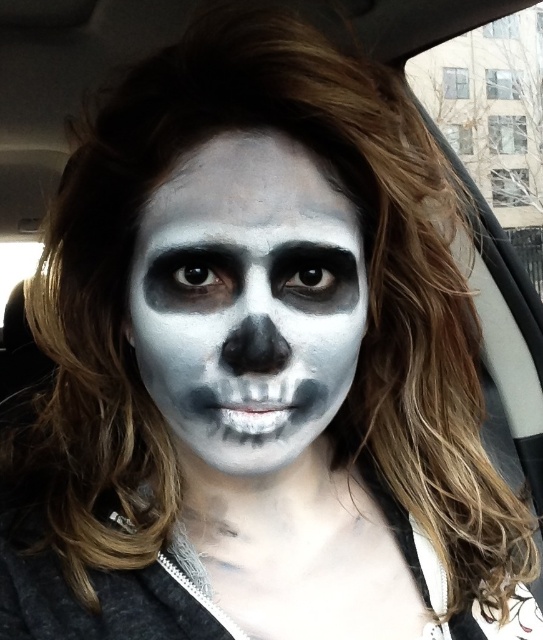
Based on the photo, you are a makeup artist assessing the facial coverage of the person in the car. You see the white matte skull makeup at center and the white matte skeleton face paint at center. Which one covers a smaller area on the face?

The white matte skull makeup at center covers a smaller area on the face compared to the white matte skeleton face paint at center, as it occupies less space according to the description.

You are a makeup artist standing 30 centimeters away from the white matte skull makeup at center. Can you apply touchups to the makeup without moving closer?

The distance between the white matte skull makeup at center and the viewer is 31.37 centimeters. Since you are already 30 centimeters away, you need to move 1.37 centimeters closer to reach the makeup.